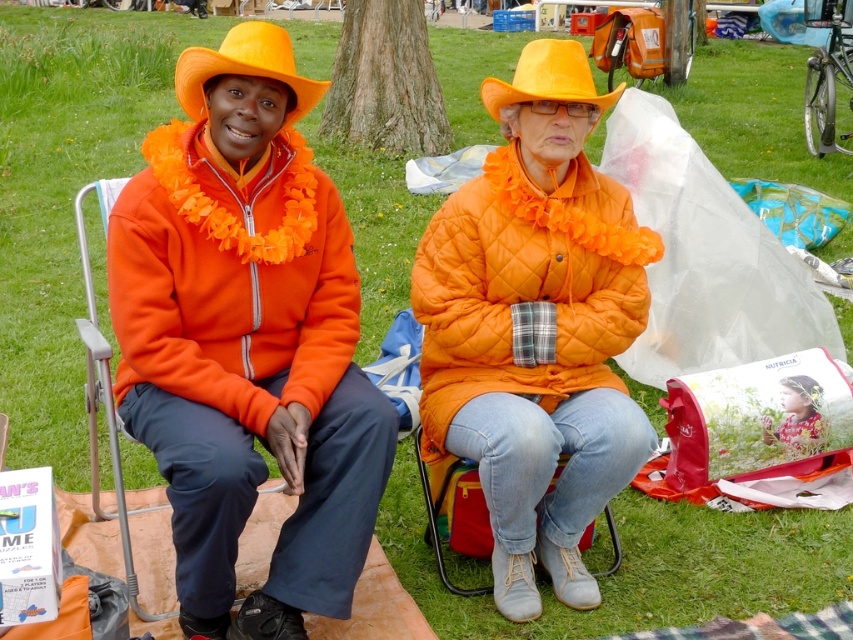
Is quilted orange coat at center taller than orange matte hat at center?

Correct, quilted orange coat at center is much taller as orange matte hat at center.

Is the position of quilted orange coat at center more distant than that of orange matte hat at center?

That is False.

Locate an element on the screen. The image size is (853, 640). quilted orange coat at center is located at coordinates (537, 326).

Who is shorter, quilted orange coat at center or orange fabric folding chair at left?

Standing shorter between the two is orange fabric folding chair at left.

Does quilted orange coat at center have a greater width compared to orange fabric folding chair at left?

No, quilted orange coat at center is not wider than orange fabric folding chair at left.

Which is behind, point (486, 435) or point (83, 236)?

Point (83, 236)

Find the location of a particular element. The image size is (853, 640). quilted orange coat at center is located at coordinates (537, 326).

Does orange matte hat at center have a greater width compared to floral fabric at center?

Yes, orange matte hat at center is wider than floral fabric at center.

Does orange matte hat at center appear on the left side of floral fabric at center?

Indeed, orange matte hat at center is positioned on the left side of floral fabric at center.

Which is behind, point (614, 92) or point (769, 426)?

The point (769, 426) is behind.

Image resolution: width=853 pixels, height=640 pixels. In order to click on orange matte hat at center in this screenshot , I will do `click(547, 77)`.